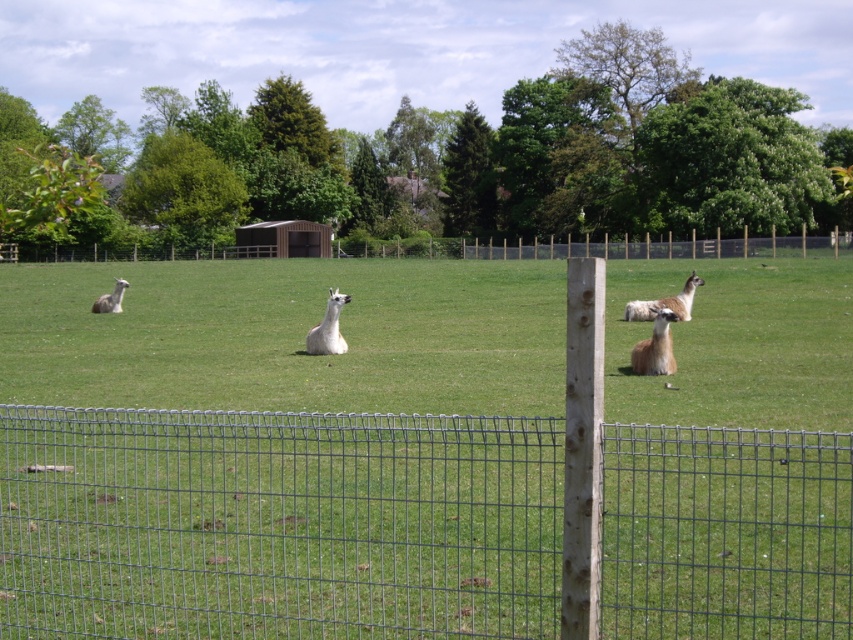
Can you confirm if wire mesh fence at center is positioned below wooden post at center?

Yes.

Can you confirm if wire mesh fence at center is thinner than wooden post at center?

Correct, wire mesh fence at center's width is less than wooden post at center's.

Which is behind, point (22, 458) or point (534, 253)?

Positioned behind is point (534, 253).

Where is `wire mesh fence at center`? wire mesh fence at center is located at coordinates (277, 524).

Is point (654, 246) behind point (97, 308)?

That is True.

Is the position of wooden post at center more distant than that of white woolly alpaca at left?

Yes, wooden post at center is behind white woolly alpaca at left.

Is point (782, 237) less distant than point (102, 296)?

No, (782, 237) is behind (102, 296).

Where is `wooden post at center`? wooden post at center is located at coordinates (718, 244).

Is point (631, 369) farther from viewer compared to point (126, 284)?

No, (631, 369) is in front of (126, 284).

Between fuzzy brown alpaca at center-right and white woolly alpaca at left, which one is positioned higher?

white woolly alpaca at left is above.

Find the location of a particular element. fuzzy brown alpaca at center-right is located at coordinates (654, 346).